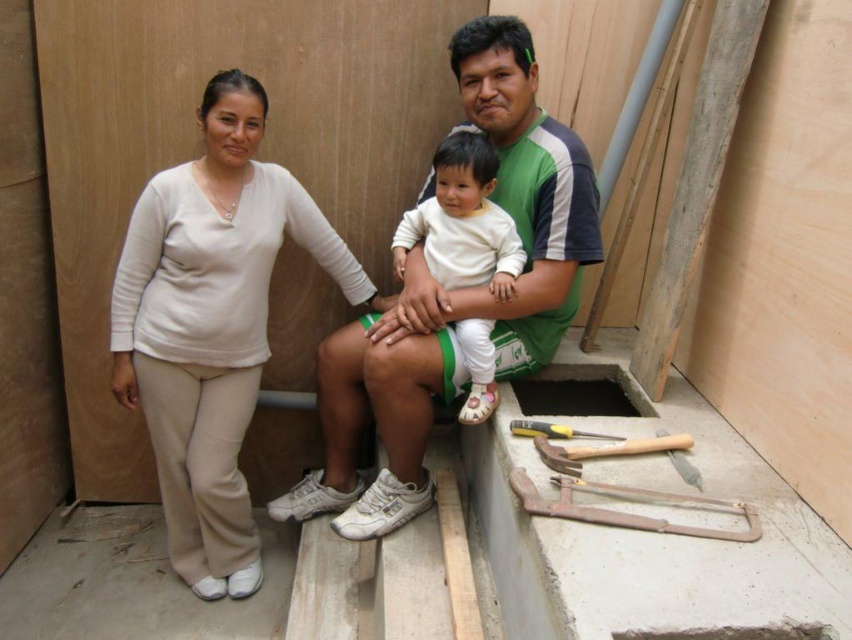
This screenshot has height=640, width=852. What do you see at coordinates (213, 324) in the screenshot?
I see `beige fabric pants at left` at bounding box center [213, 324].

Who is higher up, beige fabric pants at left or rusty metal saw at lower right?

beige fabric pants at left

The height and width of the screenshot is (640, 852). Describe the element at coordinates (213, 324) in the screenshot. I see `beige fabric pants at left` at that location.

Find the location of `beige fabric pants at left`. beige fabric pants at left is located at coordinates (213, 324).

Which is below, rusty metal saw at lower right or yellow plastic screwdriver at lower center?

rusty metal saw at lower right is lower down.

Measure the distance between rusty metal saw at lower right and camera.

rusty metal saw at lower right and camera are 1.64 meters apart.

Locate an element on the screen. This screenshot has height=640, width=852. rusty metal saw at lower right is located at coordinates (623, 512).

Image resolution: width=852 pixels, height=640 pixels. Find the location of `rusty metal saw at lower right`. rusty metal saw at lower right is located at coordinates (623, 512).

Is point (250, 513) more distant than point (459, 378)?

Yes, it is behind point (459, 378).

Does beige fabric pants at left have a lesser width compared to green fabric shirt at center?

Yes.

Who is more distant from viewer, (206, 326) or (568, 284)?

The point (206, 326) is behind.

Find the location of `beige fabric pants at left`. beige fabric pants at left is located at coordinates (213, 324).